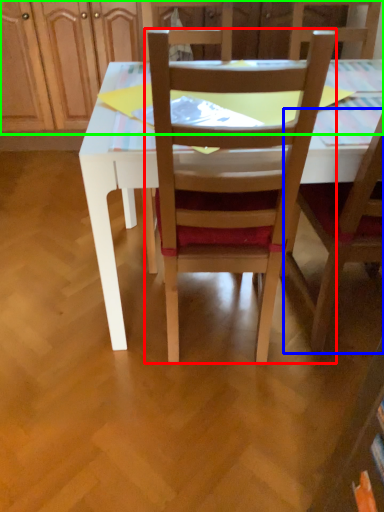
Question: Based on their relative distances, which object is farther from chair (highlighted by a red box)? Choose from chair (highlighted by a blue box) and dresser (highlighted by a green box).

Choices:
 (A) chair
 (B) dresser

Answer: (B)